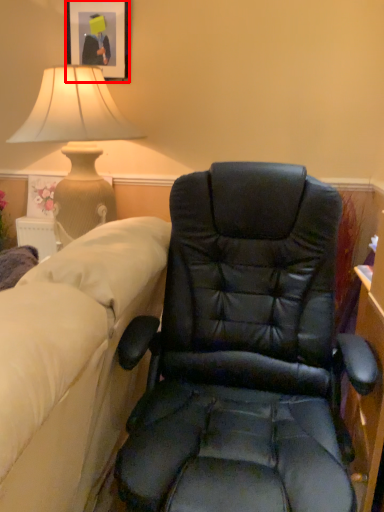
Question: From the image's perspective, what is the correct spatial relationship of picture frame (annotated by the red box) in relation to chair?

Choices:
 (A) above
 (B) below

Answer: (A)